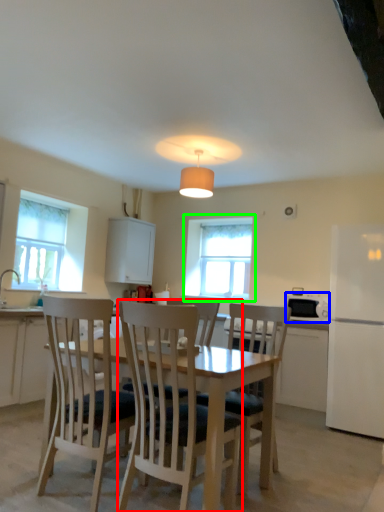
Question: Considering the real-world distances, which object is farthest from chair (highlighted by a red box)? appliance (highlighted by a blue box) or window (highlighted by a green box)?

Choices:
 (A) appliance
 (B) window

Answer: (B)